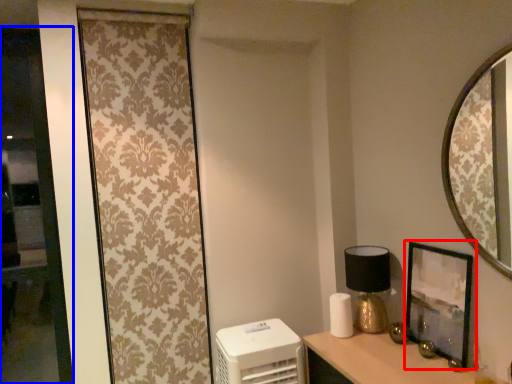
Question: Which point is closer to the camera, picture frame (highlighted by a red box) or glass door (highlighted by a blue box)?

Choices:
 (A) picture frame
 (B) glass door

Answer: (A)